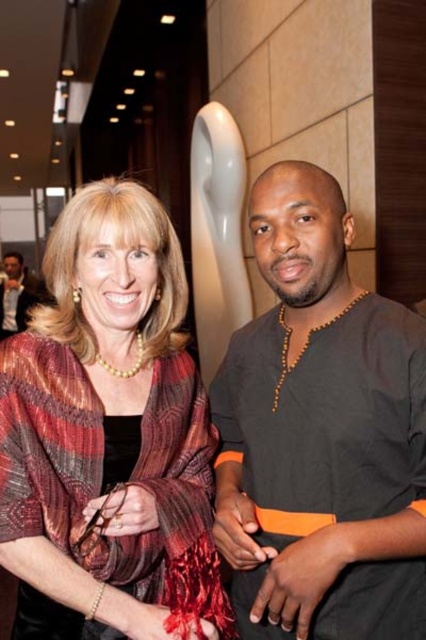
Question: Does matte red scarf at center appear under matte black shirt at left?

Choices:
 (A) no
 (B) yes

Answer: (B)

Question: Which object is the farthest from the matte black shirt at left?

Choices:
 (A) black matte shirt at right
 (B) matte red scarf at center

Answer: (A)

Question: Does matte red scarf at center appear on the left side of matte black shirt at left?

Choices:
 (A) no
 (B) yes

Answer: (A)

Question: Among these points, which one is nearest to the camera?

Choices:
 (A) (13, 312)
 (B) (293, 620)
 (C) (207, 566)

Answer: (B)

Question: Does matte red scarf at center have a greater width compared to matte black shirt at left?

Choices:
 (A) yes
 (B) no

Answer: (B)

Question: Which object is positioned farthest from the matte red scarf at center?

Choices:
 (A) matte black shirt at left
 (B) black matte shirt at right

Answer: (A)